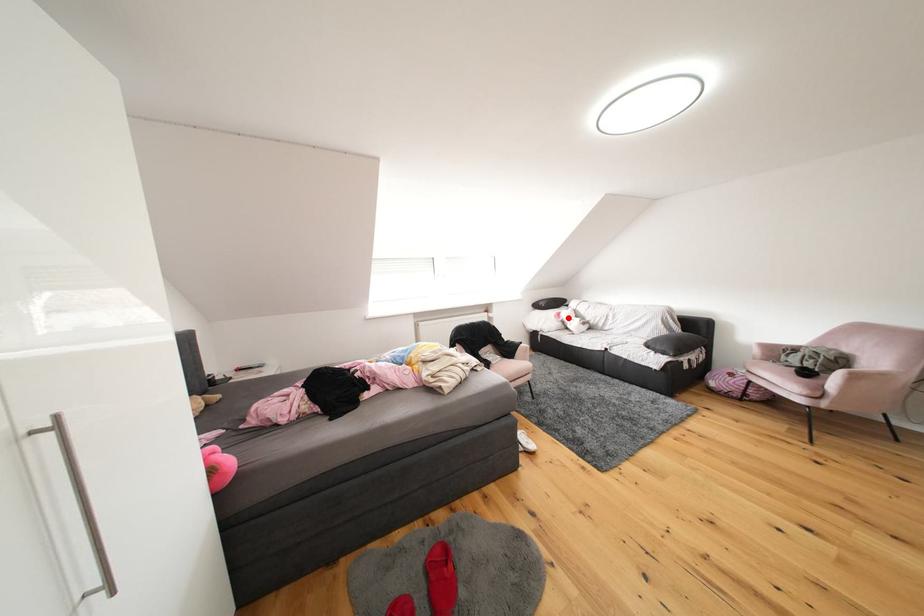
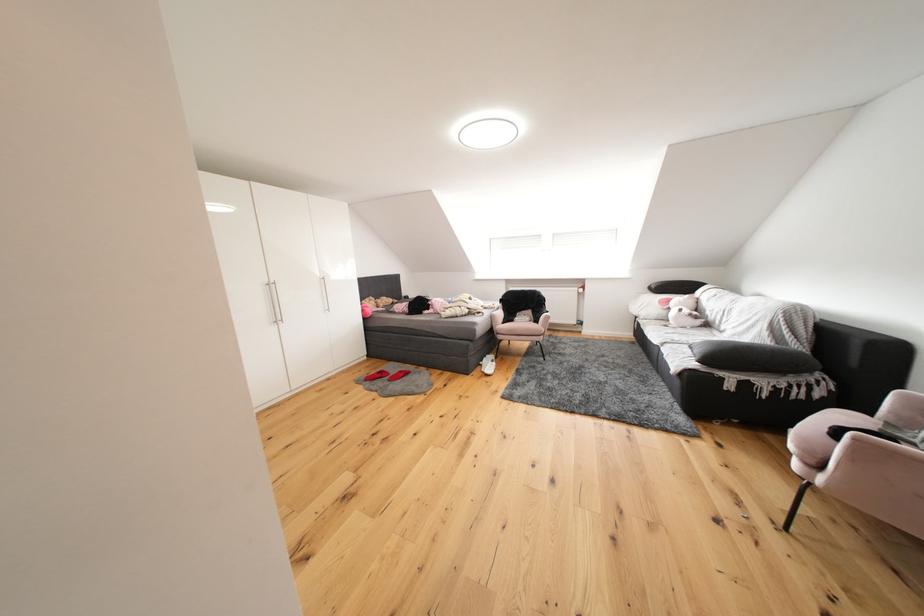
Where in the second image is the point corresponding to the highlighted location from the first image?

(677, 305)